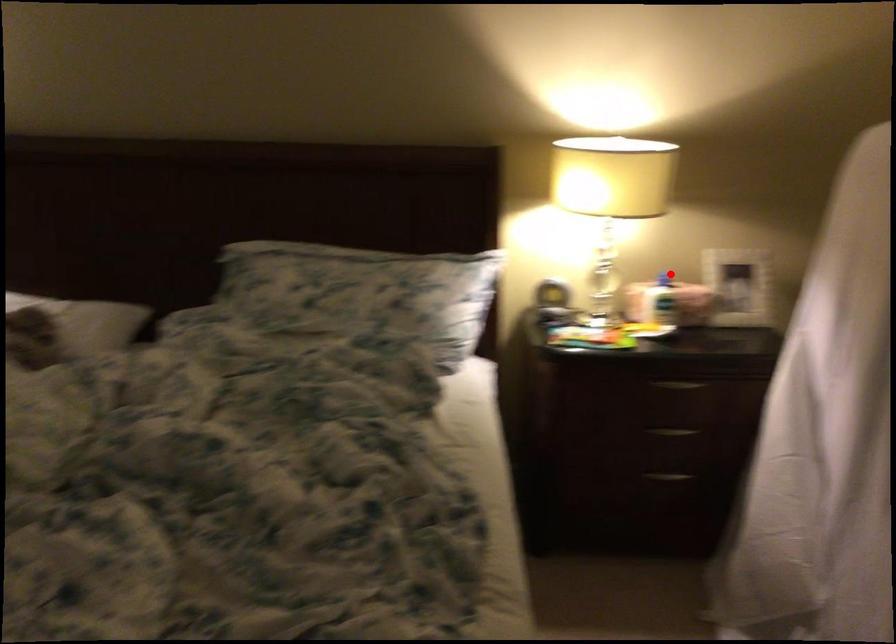
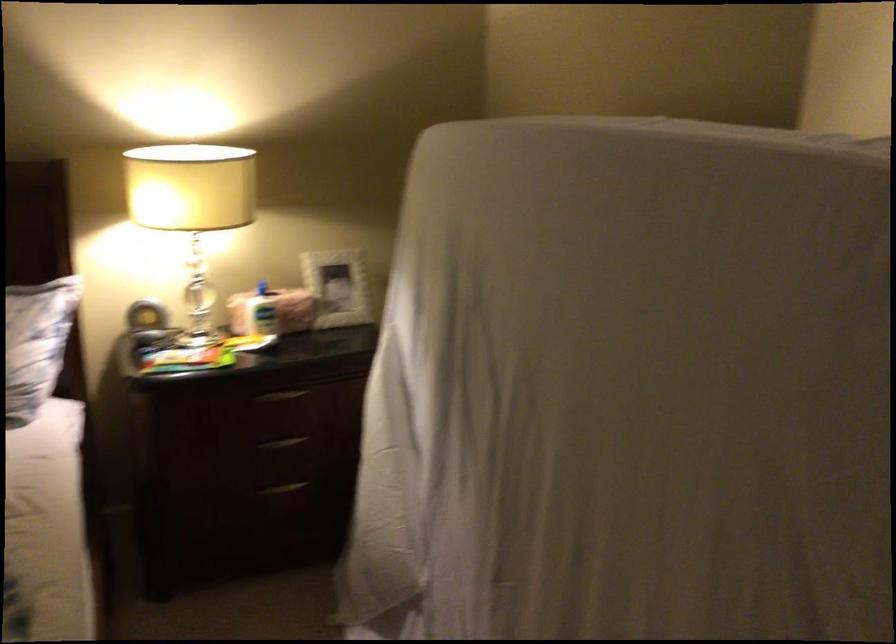
The point at the highlighted location is marked in the first image. Where is the corresponding point in the second image?

(262, 288)